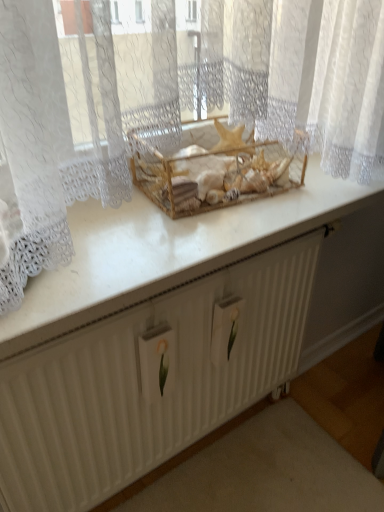
Question: Does wooden crate at center come in front of white textured radiator at center?

Choices:
 (A) no
 (B) yes

Answer: (A)

Question: Is wooden crate at center oriented away from white textured radiator at center?

Choices:
 (A) no
 (B) yes

Answer: (A)

Question: Can you confirm if wooden crate at center is bigger than white textured radiator at center?

Choices:
 (A) yes
 (B) no

Answer: (B)

Question: From a real-world perspective, is wooden crate at center physically above white textured radiator at center?

Choices:
 (A) no
 (B) yes

Answer: (B)

Question: Can we say wooden crate at center lies outside white textured radiator at center?

Choices:
 (A) yes
 (B) no

Answer: (A)

Question: Does wooden crate at center have a greater height compared to white textured radiator at center?

Choices:
 (A) yes
 (B) no

Answer: (B)

Question: Is white textured radiator at center positioned with its back to white glossy counter top at center?

Choices:
 (A) no
 (B) yes

Answer: (A)

Question: Considering the relative sizes of white textured radiator at center and white glossy counter top at center in the image provided, is white textured radiator at center thinner than white glossy counter top at center?

Choices:
 (A) yes
 (B) no

Answer: (A)

Question: From a real-world perspective, does white textured radiator at center sit lower than white glossy counter top at center?

Choices:
 (A) no
 (B) yes

Answer: (B)

Question: Are white textured radiator at center and white glossy counter top at center far apart?

Choices:
 (A) no
 (B) yes

Answer: (A)

Question: Is white textured radiator at center smaller than white glossy counter top at center?

Choices:
 (A) no
 (B) yes

Answer: (A)

Question: Can you confirm if white textured radiator at center is bigger than white glossy counter top at center?

Choices:
 (A) yes
 (B) no

Answer: (A)

Question: Does wooden crate at center appear on the right side of white glossy counter top at center?

Choices:
 (A) yes
 (B) no

Answer: (A)